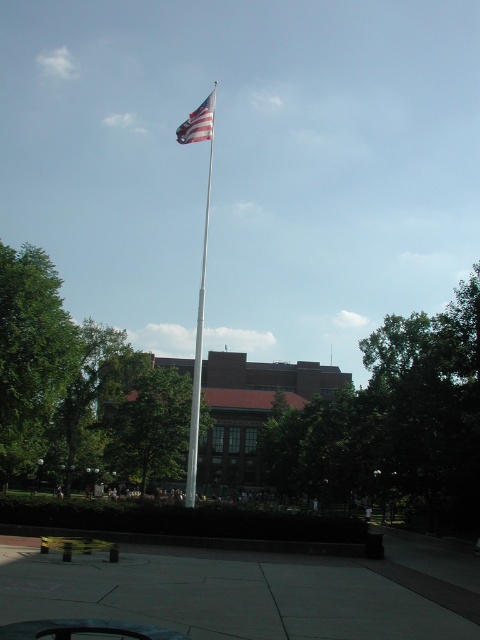
Question: Which object appears closest to the camera in this image?

Choices:
 (A) white metallic flag pole at center
 (B) american flag at upper center

Answer: (A)

Question: Does white metallic flag pole at center appear on the right side of american flag at upper center?

Choices:
 (A) yes
 (B) no

Answer: (A)

Question: Does white metallic flag pole at center have a greater width compared to american flag at upper center?

Choices:
 (A) yes
 (B) no

Answer: (B)

Question: Among these points, which one is nearest to the camera?

Choices:
 (A) (201, 106)
 (B) (188, 497)

Answer: (B)

Question: Which object is closer to the camera taking this photo?

Choices:
 (A) white metallic flag pole at center
 (B) american flag at upper center

Answer: (A)

Question: Is white metallic flag pole at center thinner than american flag at upper center?

Choices:
 (A) yes
 (B) no

Answer: (A)